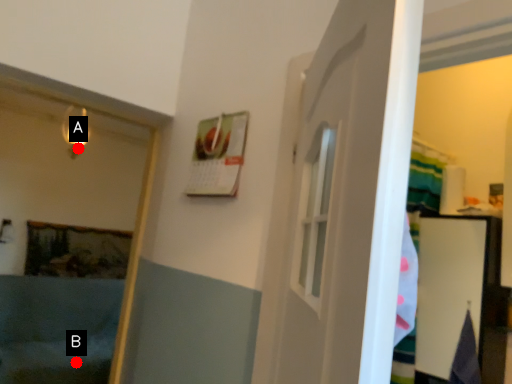
Question: Two points are circled on the image, labeled by A and B beside each circle. Which of the following is the farthest from the observer?

Choices:
 (A) A is further
 (B) B is further

Answer: (B)